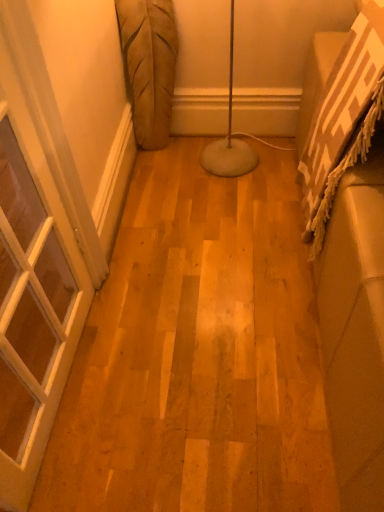
Where is `clear glass door at left`? clear glass door at left is located at coordinates [31, 321].

Describe the element at coordinates (31, 321) in the screenshot. This screenshot has height=512, width=384. I see `clear glass door at left` at that location.

Locate an element on the screen. Image resolution: width=384 pixels, height=512 pixels. clear glass door at left is located at coordinates pos(31,321).